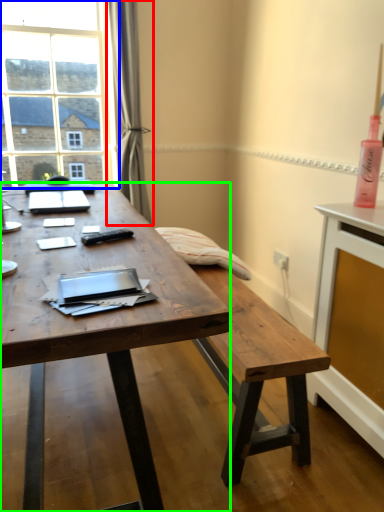
Question: Based on their relative distances, which object is nearer to curtain (highlighted by a red box)? Choose from window (highlighted by a blue box) and desk (highlighted by a green box).

Choices:
 (A) window
 (B) desk

Answer: (A)